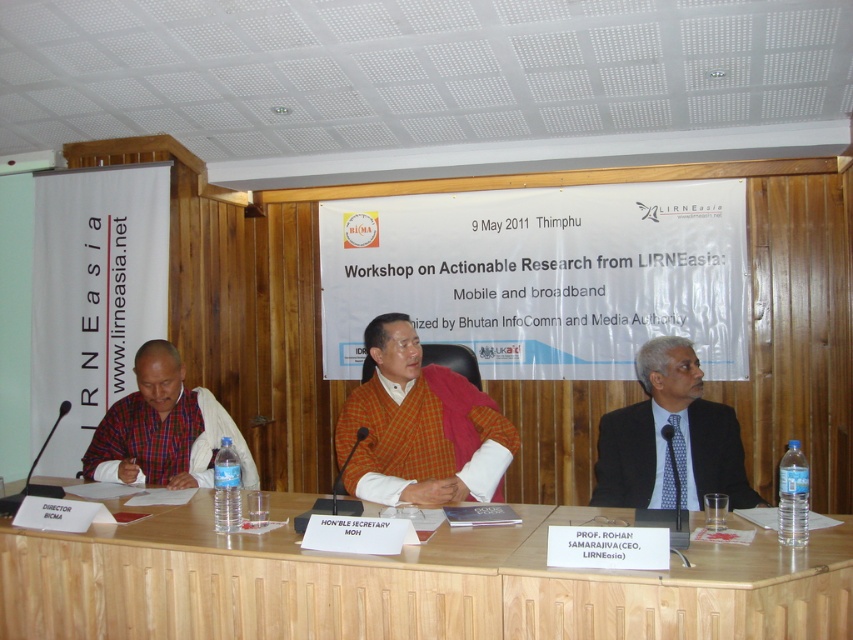
Question: Does white paper at center appear on the left side of orange woolen sweater at center?

Choices:
 (A) no
 (B) yes

Answer: (A)

Question: Does light brown wood table at center have a lesser width compared to orange woolen sweater at center?

Choices:
 (A) yes
 (B) no

Answer: (B)

Question: Which of these objects is positioned farthest from the white paper at center?

Choices:
 (A) matte plaid shirt at left
 (B) light brown wood table at center

Answer: (B)

Question: Is white paper at center further to the viewer compared to dark blue suit at right?

Choices:
 (A) yes
 (B) no

Answer: (A)

Question: Which object is farther from the camera taking this photo?

Choices:
 (A) dark blue suit at right
 (B) white paper at center
 (C) orange woolen sweater at center
 (D) light brown wood table at center

Answer: (B)

Question: Which object is positioned farthest from the orange woolen sweater at center?

Choices:
 (A) light brown wood table at center
 (B) matte plaid shirt at left
 (C) dark blue suit at right
 (D) white paper at center

Answer: (D)